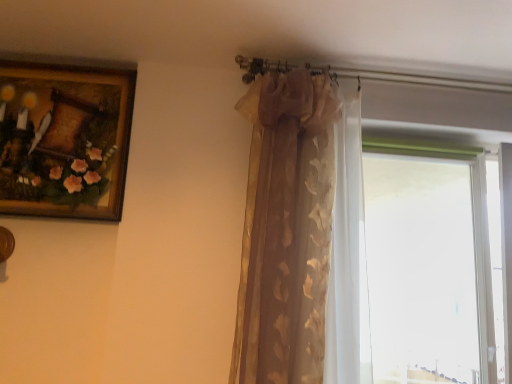
You are a GUI agent. You are given a task and a screenshot of the screen. Output one action in this format:
    pyautogui.click(x=<x>, y=<y>)
    Task: Click on the gold textured curtain at upper center
    The height and width of the screenshot is (384, 512).
    Given the screenshot: What is the action you would take?
    pyautogui.click(x=287, y=228)

Measure the distance between point (439,321) and camera.

The depth of point (439,321) is 11.22 feet.

At what (x,y) coordinates should I click in order to perform the action: click on wooden framed painting at upper left. Please return your answer as a coordinate pair (x, y). Looking at the image, I should click on (64, 140).

From a real-world perspective, relative to wooden framed painting at upper left, is gold textured curtain at upper center vertically above or below?

gold textured curtain at upper center is below wooden framed painting at upper left.

Between gold textured curtain at upper center and wooden framed painting at upper left, which one has smaller size?

With smaller size is wooden framed painting at upper left.

Does point (331, 240) come behind point (39, 190)?

No, (331, 240) is in front of (39, 190).

Can we say gold textured curtain at upper center lies outside wooden framed painting at upper left?

Absolutely, gold textured curtain at upper center is external to wooden framed painting at upper left.

From a real-world perspective, which object stands above the other?

gold textured curtain at upper center.

Can you confirm if transparent glass window at right is wider than gold textured curtain at upper center?

No.

Which object is positioned more to the right, transparent glass window at right or gold textured curtain at upper center?

Positioned to the right is transparent glass window at right.

How much distance is there between transparent glass window at right and gold textured curtain at upper center?

They are 1.86 meters apart.

Can you confirm if gold textured curtain at upper center is thinner than transparent glass window at right?

In fact, gold textured curtain at upper center might be wider than transparent glass window at right.

Who is more distant, gold textured curtain at upper center or transparent glass window at right?

transparent glass window at right is further away from the camera.

Can transparent glass window at right be found inside gold textured curtain at upper center?

No, transparent glass window at right is located outside of gold textured curtain at upper center.

Which of these two, wooden framed painting at upper left or transparent glass window at right, is smaller?

transparent glass window at right.

Does wooden framed painting at upper left appear on the right side of transparent glass window at right?

Incorrect, wooden framed painting at upper left is not on the right side of transparent glass window at right.

Is wooden framed painting at upper left positioned beyond the bounds of gold textured curtain at upper center?

Indeed, wooden framed painting at upper left is completely outside gold textured curtain at upper center.

Can you confirm if wooden framed painting at upper left is thinner than gold textured curtain at upper center?

Correct, the width of wooden framed painting at upper left is less than that of gold textured curtain at upper center.

Would you consider wooden framed painting at upper left to be distant from gold textured curtain at upper center?

Actually, wooden framed painting at upper left and gold textured curtain at upper center are a little close together.

From a real-world perspective, is wooden framed painting at upper left physically located above or below gold textured curtain at upper center?

wooden framed painting at upper left is above gold textured curtain at upper center.

Who is taller, transparent glass window at right or wooden framed painting at upper left?

Standing taller between the two is transparent glass window at right.

Considering the sizes of objects transparent glass window at right and wooden framed painting at upper left in the image provided, who is thinner, transparent glass window at right or wooden framed painting at upper left?

transparent glass window at right is thinner.

Is transparent glass window at right in front of wooden framed painting at upper left?

No, it is behind wooden framed painting at upper left.

Looking at this image, is transparent glass window at right positioned with its back to wooden framed painting at upper left?

transparent glass window at right is not turned away from wooden framed painting at upper left.

Locate an element on the screen. picture frame behind the gold textured curtain at upper center is located at coordinates (64, 140).

The height and width of the screenshot is (384, 512). Identify the location of window below the gold textured curtain at upper center (from a real-world perspective). (431, 265).

Looking at the image, which one is located further to gold textured curtain at upper center, transparent glass window at right or wooden framed painting at upper left?

transparent glass window at right.

Which object lies further to the anchor point transparent glass window at right, wooden framed painting at upper left or gold textured curtain at upper center?

Among the two, wooden framed painting at upper left is located further to transparent glass window at right.

Looking at the image, which one is located further to gold textured curtain at upper center, wooden framed painting at upper left or transparent glass window at right?

Based on the image, transparent glass window at right appears to be further to gold textured curtain at upper center.

When comparing their distances from wooden framed painting at upper left, does transparent glass window at right or gold textured curtain at upper center seem further?

Among the two, transparent glass window at right is located further to wooden framed painting at upper left.

From the image, which object appears to be nearer to wooden framed painting at upper left, gold textured curtain at upper center or transparent glass window at right?

Among the two, gold textured curtain at upper center is located nearer to wooden framed painting at upper left.

Which object lies nearer to the anchor point transparent glass window at right, gold textured curtain at upper center or wooden framed painting at upper left?

gold textured curtain at upper center.

Locate an element on the screen. curtain situated between wooden framed painting at upper left and transparent glass window at right from left to right is located at coordinates (287, 228).